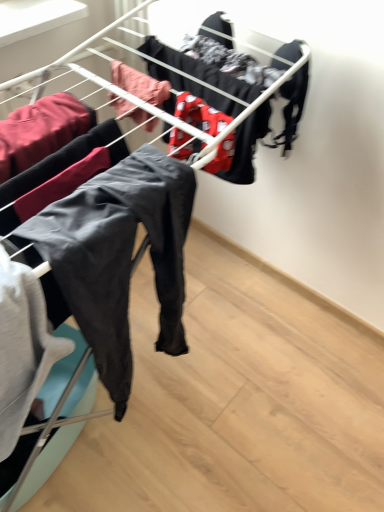
Where is `black matte underwear at upper right, the first clothing in the right-to-left sequence`? This screenshot has height=512, width=384. black matte underwear at upper right, the first clothing in the right-to-left sequence is located at coordinates (292, 108).

Measure the distance between black matte underwear at upper right, the first clothing in the right-to-left sequence, and camera.

black matte underwear at upper right, the first clothing in the right-to-left sequence, is 38.78 inches away from camera.

Find the location of a particular element. The height and width of the screenshot is (512, 384). matte black pants at left, the 1th clothing positioned from the left is located at coordinates (41, 131).

This screenshot has width=384, height=512. What do you see at coordinates (200, 114) in the screenshot?
I see `red fabric with white patterns at center, marked as the second clothing in a right-to-left arrangement` at bounding box center [200, 114].

Measure the distance between point [222,159] and camera.

Point [222,159] and camera are 1.05 meters apart.

You are a GUI agent. You are given a task and a screenshot of the screen. Output one action in this format:
    pyautogui.click(x=<x>, y=<y>)
    Task: Click on the pink fabric at center, which ranks as the third clothing in right-to-left order
    The width and height of the screenshot is (384, 512).
    Given the screenshot: What is the action you would take?
    pyautogui.click(x=140, y=84)

Does point (141, 217) come behind point (79, 101)?

No, (141, 217) is closer to viewer.

Which object is positioned more to the left, matte black pants at center, which is the second clothing from left to right, or matte black pants at left, the 1th clothing positioned from the left?

Positioned to the left is matte black pants at left, the 1th clothing positioned from the left.

How different are the orientations of matte black pants at center, which is the second clothing from left to right, and matte black pants at left, the 1th clothing positioned from the left, in degrees?

matte black pants at center, which is the second clothing from left to right, and matte black pants at left, the 1th clothing positioned from the left, are facing 0.000691 degrees away from each other.

Can you confirm if matte black pants at center, which is the second clothing from left to right, is thinner than matte black pants at left, the 5th clothing positioned from the right?

Yes, matte black pants at center, which is the second clothing from left to right, is thinner than matte black pants at left, the 5th clothing positioned from the right.

Which is more to the left, matte black pants at left, the 1th clothing positioned from the left, or black matte underwear at upper right, the 5th clothing from the left?

Positioned to the left is matte black pants at left, the 1th clothing positioned from the left.

Is matte black pants at left, the 5th clothing positioned from the right, facing away from black matte underwear at upper right, the first clothing in the right-to-left sequence?

matte black pants at left, the 5th clothing positioned from the right, does not have its back to black matte underwear at upper right, the first clothing in the right-to-left sequence.

From a real-world perspective, is matte black pants at left, the 1th clothing positioned from the left, on top of black matte underwear at upper right, the first clothing in the right-to-left sequence?

No, from a real-world perspective, matte black pants at left, the 1th clothing positioned from the left, is not on top of black matte underwear at upper right, the first clothing in the right-to-left sequence.

Is matte black pants at left, the 1th clothing positioned from the left, positioned beyond the bounds of black matte underwear at upper right, the 5th clothing from the left?

matte black pants at left, the 1th clothing positioned from the left, lies outside black matte underwear at upper right, the 5th clothing from the left,'s area.

Is matte black pants at left, the 1th clothing positioned from the left, facing away from red fabric with white patterns at center, marked as the second clothing in a right-to-left arrangement?

No, red fabric with white patterns at center, marked as the second clothing in a right-to-left arrangement, is not at the back of matte black pants at left, the 1th clothing positioned from the left.

Which object is further away from the camera, matte black pants at left, the 1th clothing positioned from the left, or red fabric with white patterns at center, marked as the second clothing in a right-to-left arrangement?

red fabric with white patterns at center, marked as the second clothing in a right-to-left arrangement.

Considering the sizes of matte black pants at left, the 5th clothing positioned from the right, and red fabric with white patterns at center, marked as the second clothing in a right-to-left arrangement, in the image, is matte black pants at left, the 5th clothing positioned from the right, taller or shorter than red fabric with white patterns at center, marked as the second clothing in a right-to-left arrangement,?

→ Considering their sizes, matte black pants at left, the 5th clothing positioned from the right, has more height than red fabric with white patterns at center, marked as the second clothing in a right-to-left arrangement.

Between matte black pants at left, the 5th clothing positioned from the right, and red fabric with white patterns at center, marked as the second clothing in a right-to-left arrangement, which one appears on the left side from the viewer's perspective?

From the viewer's perspective, matte black pants at left, the 5th clothing positioned from the right, appears more on the left side.

Would you say pink fabric at center, which appears as the third clothing when viewed from the left, is a long distance from red fabric with white patterns at center, positioned as the 4th clothing in left-to-right order?

No, pink fabric at center, which appears as the third clothing when viewed from the left, is not far from red fabric with white patterns at center, positioned as the 4th clothing in left-to-right order.

Consider the image. Considering the relative positions of pink fabric at center, which ranks as the third clothing in right-to-left order, and red fabric with white patterns at center, positioned as the 4th clothing in left-to-right order, in the image provided, is pink fabric at center, which ranks as the third clothing in right-to-left order, to the left or to the right of red fabric with white patterns at center, positioned as the 4th clothing in left-to-right order,?

Based on their positions, pink fabric at center, which ranks as the third clothing in right-to-left order, is located to the left of red fabric with white patterns at center, positioned as the 4th clothing in left-to-right order.

Which is in front, point (129, 92) or point (209, 126)?

The point (209, 126) is closer.

From the image's perspective, who appears lower, matte black pants at center, positioned as the fourth clothing in right-to-left order, or black matte underwear at upper right, the first clothing in the right-to-left sequence?

matte black pants at center, positioned as the fourth clothing in right-to-left order, from the image's perspective.

At what (x,y) coordinates should I click in order to perform the action: click on the 4th clothing in front of the black matte underwear at upper right, the first clothing in the right-to-left sequence, counting from the anchor's position. Please return your answer as a coordinate pair (x, y). The image size is (384, 512). Looking at the image, I should click on (120, 256).

Looking at this image, how many degrees apart are the facing directions of matte black pants at center, which is the second clothing from left to right, and black matte underwear at upper right, the first clothing in the right-to-left sequence?

They differ by 0.00106 degrees in their facing directions.

From a real-world perspective, is matte black pants at center, positioned as the fourth clothing in right-to-left order, physically located above or below black matte underwear at upper right, the 5th clothing from the left?

Clearly, from a real-world perspective, matte black pants at center, positioned as the fourth clothing in right-to-left order, is below black matte underwear at upper right, the 5th clothing from the left.

From a real-world perspective, is black matte underwear at upper right, the first clothing in the right-to-left sequence, physically located above or below pink fabric at center, which ranks as the third clothing in right-to-left order?

black matte underwear at upper right, the first clothing in the right-to-left sequence, is situated lower than pink fabric at center, which ranks as the third clothing in right-to-left order, in the real world.

Can you tell me how much black matte underwear at upper right, the first clothing in the right-to-left sequence, and pink fabric at center, which ranks as the third clothing in right-to-left order, differ in facing direction?

0.000419 degrees.

Is black matte underwear at upper right, the first clothing in the right-to-left sequence, further to the viewer compared to pink fabric at center, which ranks as the third clothing in right-to-left order?

Yes, black matte underwear at upper right, the first clothing in the right-to-left sequence, is behind pink fabric at center, which ranks as the third clothing in right-to-left order.

Is black matte underwear at upper right, the 5th clothing from the left, surrounding pink fabric at center, which appears as the third clothing when viewed from the left?

No, black matte underwear at upper right, the 5th clothing from the left, does not contain pink fabric at center, which appears as the third clothing when viewed from the left.

Which object is thinner, red fabric with white patterns at center, marked as the second clothing in a right-to-left arrangement, or pink fabric at center, which ranks as the third clothing in right-to-left order?

red fabric with white patterns at center, marked as the second clothing in a right-to-left arrangement.

Are red fabric with white patterns at center, marked as the second clothing in a right-to-left arrangement, and pink fabric at center, which ranks as the third clothing in right-to-left order, far apart?

Actually, red fabric with white patterns at center, marked as the second clothing in a right-to-left arrangement, and pink fabric at center, which ranks as the third clothing in right-to-left order, are a little close together.

Considering the relative positions of red fabric with white patterns at center, marked as the second clothing in a right-to-left arrangement, and pink fabric at center, which ranks as the third clothing in right-to-left order, in the image provided, is red fabric with white patterns at center, marked as the second clothing in a right-to-left arrangement, to the right of pink fabric at center, which ranks as the third clothing in right-to-left order, from the viewer's perspective?

Correct, you'll find red fabric with white patterns at center, marked as the second clothing in a right-to-left arrangement, to the right of pink fabric at center, which ranks as the third clothing in right-to-left order.

From a real-world perspective, which clothing is the 2nd one above the red fabric with white patterns at center, marked as the second clothing in a right-to-left arrangement? Please provide its 2D coordinates.

[(140, 84)]

This screenshot has width=384, height=512. I want to click on clothing that is on the left side of matte black pants at center, which is the second clothing from left to right, so click(41, 131).

Where is `the 3rd clothing in front when counting from the black matte underwear at upper right, the first clothing in the right-to-left sequence`? This screenshot has height=512, width=384. the 3rd clothing in front when counting from the black matte underwear at upper right, the first clothing in the right-to-left sequence is located at coordinates (41, 131).

Which object lies further to the anchor point black matte underwear at upper right, the 5th clothing from the left, red fabric with white patterns at center, marked as the second clothing in a right-to-left arrangement, or matte black pants at center, positioned as the fourth clothing in right-to-left order?

matte black pants at center, positioned as the fourth clothing in right-to-left order, is positioned further to the anchor black matte underwear at upper right, the 5th clothing from the left.

Estimate the real-world distances between objects in this image. Which object is further from red fabric with white patterns at center, marked as the second clothing in a right-to-left arrangement, matte black pants at center, positioned as the fourth clothing in right-to-left order, or matte black pants at left, the 1th clothing positioned from the left?

matte black pants at left, the 1th clothing positioned from the left.

Which object lies nearer to the anchor point matte black pants at center, positioned as the fourth clothing in right-to-left order, pink fabric at center, which appears as the third clothing when viewed from the left, or red fabric with white patterns at center, marked as the second clothing in a right-to-left arrangement?

Result: red fabric with white patterns at center, marked as the second clothing in a right-to-left arrangement.

Looking at this image, estimate the real-world distances between objects in this image. Which object is closer to matte black pants at left, the 1th clothing positioned from the left, pink fabric at center, which appears as the third clothing when viewed from the left, or black matte underwear at upper right, the first clothing in the right-to-left sequence?

Based on the image, pink fabric at center, which appears as the third clothing when viewed from the left, appears to be nearer to matte black pants at left, the 1th clothing positioned from the left.

Consider the image. From the image, which object appears to be nearer to pink fabric at center, which ranks as the third clothing in right-to-left order, red fabric with white patterns at center, positioned as the 4th clothing in left-to-right order, or matte black pants at center, which is the second clothing from left to right?

red fabric with white patterns at center, positioned as the 4th clothing in left-to-right order, lies closer to pink fabric at center, which ranks as the third clothing in right-to-left order, than the other object.

Looking at the image, which one is located further to pink fabric at center, which appears as the third clothing when viewed from the left, matte black pants at center, which is the second clothing from left to right, or matte black pants at left, the 5th clothing positioned from the right?

The object further to pink fabric at center, which appears as the third clothing when viewed from the left, is matte black pants at center, which is the second clothing from left to right.

Based on their spatial positions, is black matte underwear at upper right, the 5th clothing from the left, or matte black pants at left, the 5th clothing positioned from the right, closer to pink fabric at center, which appears as the third clothing when viewed from the left?

matte black pants at left, the 5th clothing positioned from the right, is positioned closer to the anchor pink fabric at center, which appears as the third clothing when viewed from the left.

Which object lies nearer to the anchor point matte black pants at left, the 5th clothing positioned from the right, black matte underwear at upper right, the first clothing in the right-to-left sequence, or matte black pants at center, positioned as the fourth clothing in right-to-left order?

Among the two, matte black pants at center, positioned as the fourth clothing in right-to-left order, is located nearer to matte black pants at left, the 5th clothing positioned from the right.

Find the location of a particular element. The image size is (384, 512). clothing between red fabric with white patterns at center, marked as the second clothing in a right-to-left arrangement, and matte black pants at center, positioned as the fourth clothing in right-to-left order, from top to bottom is located at coordinates (41, 131).

You are a GUI agent. You are given a task and a screenshot of the screen. Output one action in this format:
    pyautogui.click(x=<x>, y=<y>)
    Task: Click on the clothing situated between pink fabric at center, which ranks as the third clothing in right-to-left order, and black matte underwear at upper right, the 5th clothing from the left, from left to right
    
    Given the screenshot: What is the action you would take?
    coord(200,114)